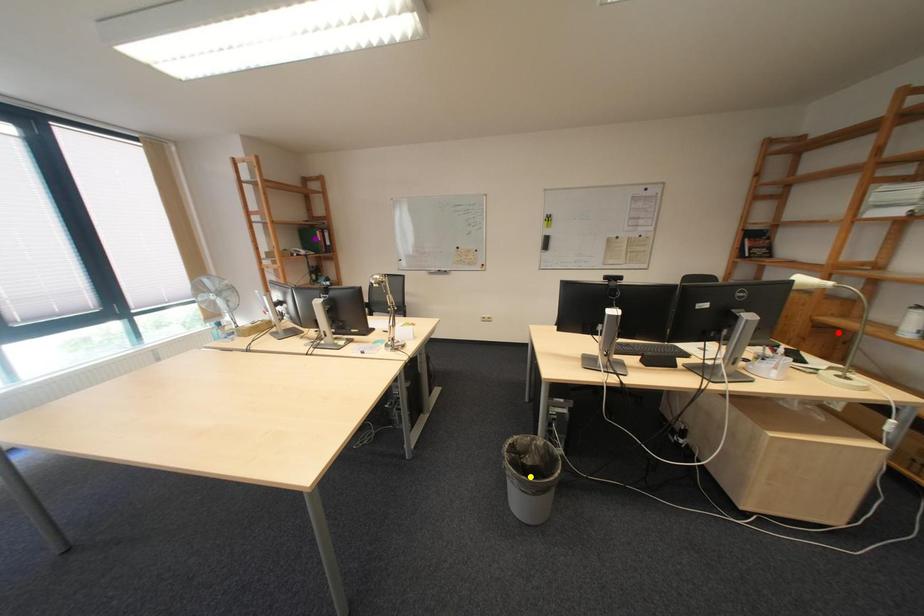
Order these from nearest to farthest:
A) yellow point
B) purple point
C) red point

red point, yellow point, purple point